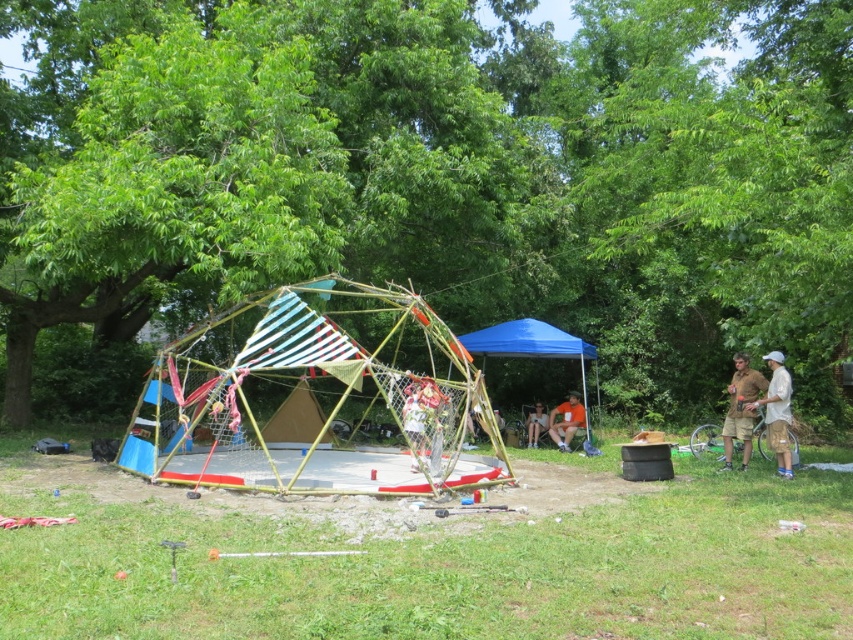
Does white cotton shirt at right have a larger size compared to orange fabric at lower center?

Incorrect, white cotton shirt at right is not larger than orange fabric at lower center.

How far apart are white cotton shirt at right and orange fabric at lower center?

They are 4.95 meters apart.

You are a GUI agent. You are given a task and a screenshot of the screen. Output one action in this format:
    pyautogui.click(x=<x>, y=<y>)
    Task: Click on the white cotton shirt at right
    
    Given the screenshot: What is the action you would take?
    pyautogui.click(x=776, y=412)

Can you confirm if green leafy tree at center is smaller than brown fabric shorts at right?

No.

Is point (33, 358) farther from camera compared to point (750, 369)?

Yes, point (33, 358) is behind point (750, 369).

Is point (850, 132) closer to camera compared to point (726, 468)?

Yes, point (850, 132) is in front of point (726, 468).

I want to click on green leafy tree at center, so click(x=436, y=177).

From the picture: Is brown fabric shorts at right to the left of orange fabric at lower center from the viewer's perspective?

No, brown fabric shorts at right is not to the left of orange fabric at lower center.

Is brown fabric shorts at right taller than orange fabric at lower center?

Yes, brown fabric shorts at right is taller than orange fabric at lower center.

Where is `brown fabric shorts at right`? The image size is (853, 640). brown fabric shorts at right is located at coordinates (740, 410).